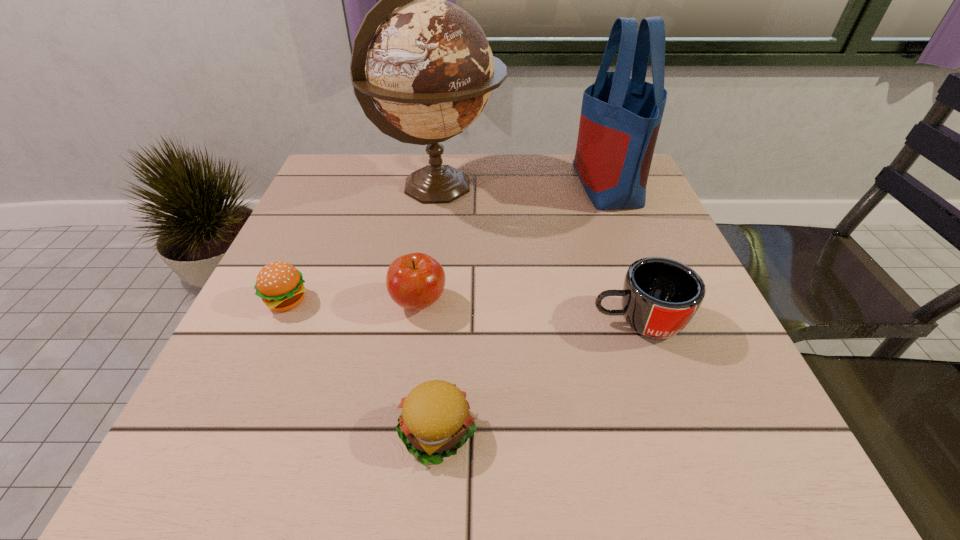
The image size is (960, 540). Identify the location of free space located on the right of the apple. (650, 302).

Identify the location of free location located on the side of the mug with the handle. (564, 321).

At what (x,y) coordinates should I click in order to perform the action: click on free point located 0.340m on the side of the mug with the handle. Please return your answer as a coordinate pair (x, y). The image size is (960, 540). Looking at the image, I should click on (406, 321).

Where is `vacant area situated 0.120m on the side of the mug with the handle`? Image resolution: width=960 pixels, height=540 pixels. vacant area situated 0.120m on the side of the mug with the handle is located at coordinates (525, 321).

Locate an element on the screen. This screenshot has height=540, width=960. vacant position located 0.350m on the right of the farther hamburger is located at coordinates (492, 301).

The height and width of the screenshot is (540, 960). I want to click on vacant space located on the right of the nearer hamburger, so pos(740,432).

Locate an element on the screen. globe located at the far edge is located at coordinates (426, 64).

Image resolution: width=960 pixels, height=540 pixels. Find the location of `handbag located in the far edge section of the desktop`. handbag located in the far edge section of the desktop is located at coordinates (620, 119).

The image size is (960, 540). I want to click on object that is at the near edge, so click(x=435, y=421).

Locate an element on the screen. globe located at the left edge is located at coordinates click(x=426, y=64).